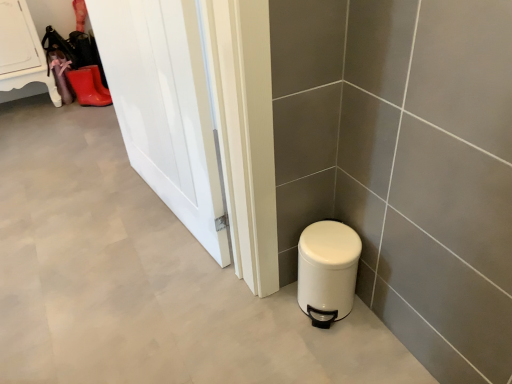
Question: Is white matte trash can at lower right facing away from white glossy door at left?

Choices:
 (A) no
 (B) yes

Answer: (B)

Question: From a real-world perspective, is white matte trash can at lower right physically above white glossy door at left?

Choices:
 (A) yes
 (B) no

Answer: (B)

Question: Can you see white matte trash can at lower right touching white glossy door at left?

Choices:
 (A) yes
 (B) no

Answer: (B)

Question: Could white glossy door at left be considered to be inside white matte trash can at lower right?

Choices:
 (A) no
 (B) yes

Answer: (A)

Question: Could you tell me if white matte trash can at lower right is facing white glossy door at left?

Choices:
 (A) no
 (B) yes

Answer: (A)

Question: Is there a large distance between white matte trash can at lower right and white glossy door at left?

Choices:
 (A) yes
 (B) no

Answer: (B)

Question: Would you say white matte trash can at lower right is a long distance from rubber matte boot at upper left?

Choices:
 (A) no
 (B) yes

Answer: (B)

Question: Does white matte trash can at lower right contain rubber matte boot at upper left?

Choices:
 (A) yes
 (B) no

Answer: (B)

Question: Considering the relative sizes of white matte trash can at lower right and rubber matte boot at upper left in the image provided, is white matte trash can at lower right taller than rubber matte boot at upper left?

Choices:
 (A) yes
 (B) no

Answer: (A)

Question: Does white matte trash can at lower right have a smaller size compared to rubber matte boot at upper left?

Choices:
 (A) yes
 (B) no

Answer: (B)

Question: Is white matte trash can at lower right closer to the viewer compared to rubber matte boot at upper left?

Choices:
 (A) no
 (B) yes

Answer: (B)

Question: Is white matte trash can at lower right turned away from rubber matte boot at upper left?

Choices:
 (A) yes
 (B) no

Answer: (A)

Question: From a real-world perspective, is rubber matte boot at upper left on top of white matte trash can at lower right?

Choices:
 (A) no
 (B) yes

Answer: (A)